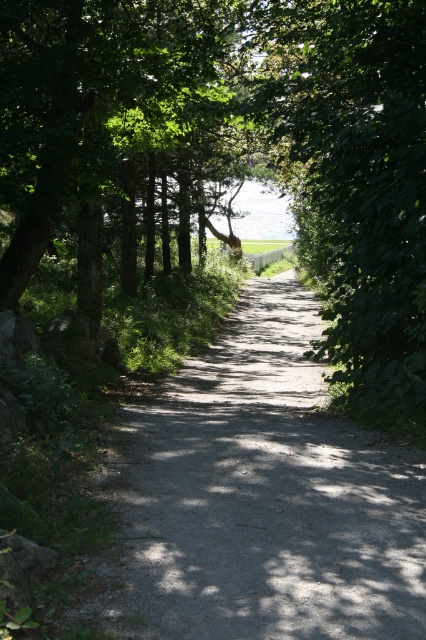
Question: Does green leafy tree at center have a greater width compared to dirt/gravel path at center?

Choices:
 (A) no
 (B) yes

Answer: (B)

Question: Which point is closer to the camera?

Choices:
 (A) dirt/gravel path at center
 (B) green leafy tree at center

Answer: (A)

Question: Does green leafy tree at center lie behind dirt/gravel path at center?

Choices:
 (A) yes
 (B) no

Answer: (A)

Question: Among these points, which one is farthest from the camera?

Choices:
 (A) (161, 408)
 (B) (241, 19)

Answer: (B)

Question: From the image, what is the correct spatial relationship of green leafy tree at center in relation to dirt/gravel path at center?

Choices:
 (A) below
 (B) above

Answer: (B)